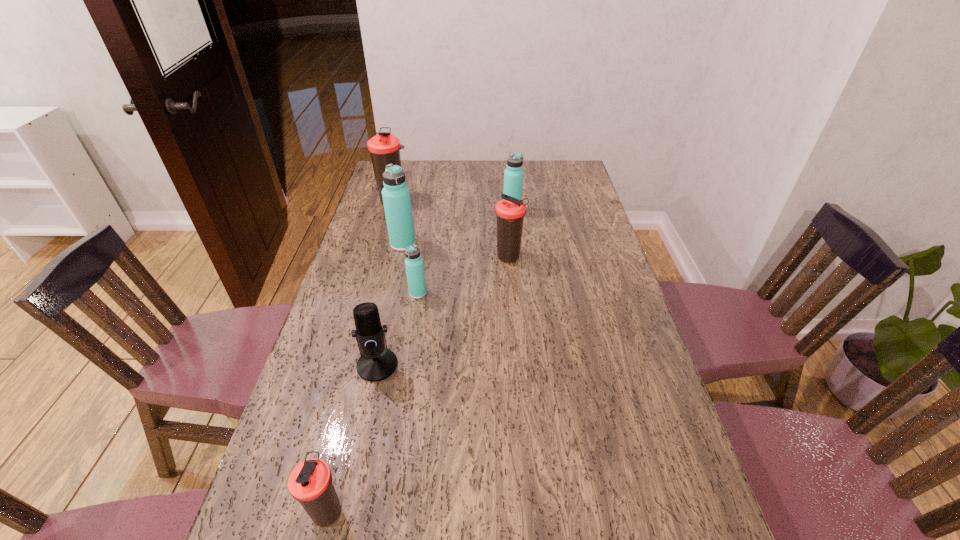
Locate an element on the screen. This screenshot has width=960, height=540. vacant region that satisfies the following two spatial constraints: 1. on the front side of the farthest brown thermos bottle; 2. on the right side of the smallest aqua thermos bottle is located at coordinates (368, 293).

The width and height of the screenshot is (960, 540). What are the coordinates of `free space that satisfies the following two spatial constraints: 1. on the back side of the smallest brown thermos bottle; 2. on the left side of the second aqua thermos bottle from left to right` in the screenshot? It's located at (383, 293).